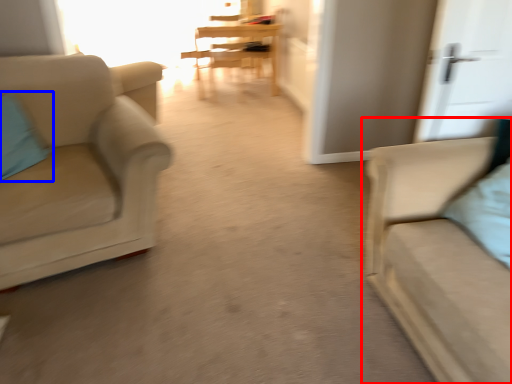
Question: Which point is closer to the camera, studio couch (highlighted by a red box) or pillow (highlighted by a blue box)?

Choices:
 (A) studio couch
 (B) pillow

Answer: (A)